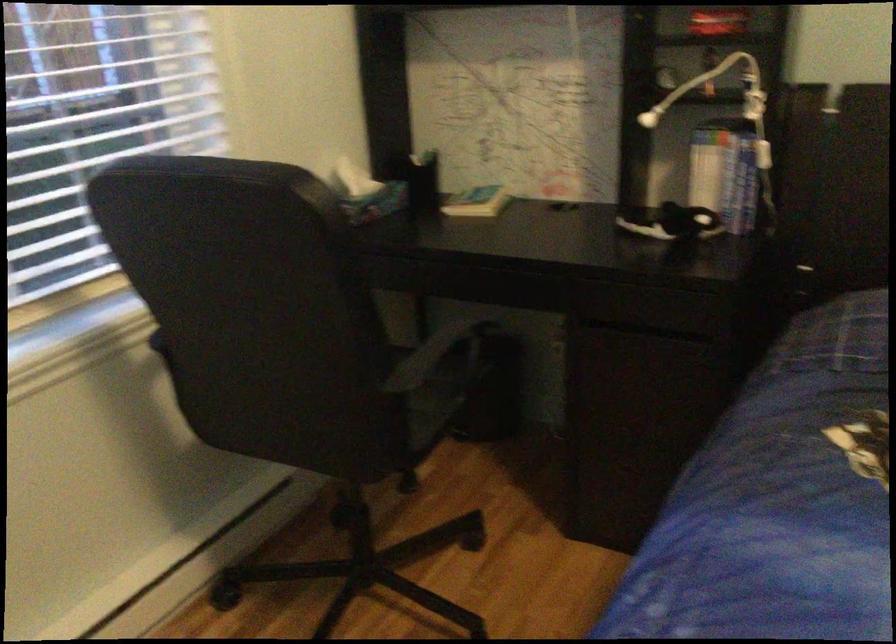
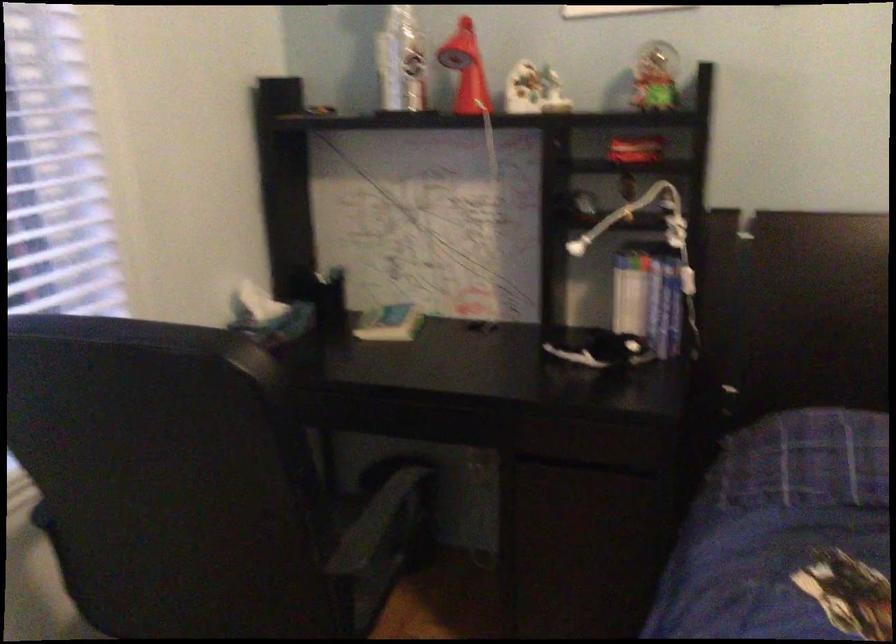
Locate, in the second image, the point that corresponds to pixel 737 182 in the first image.

(664, 307)